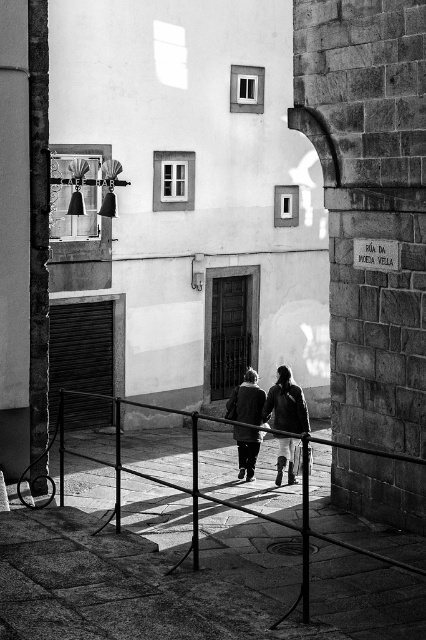
Who is lower down, smooth metal railing at center or dark gray fabric coat at center?

smooth metal railing at center is lower down.

Does smooth metal railing at center have a larger size compared to dark gray fabric coat at center?

Correct, smooth metal railing at center is larger in size than dark gray fabric coat at center.

Measure the distance between point (x=336, y=445) and camera.

Point (x=336, y=445) and camera are 8.82 meters apart.

Image resolution: width=426 pixels, height=640 pixels. I want to click on smooth metal railing at center, so click(285, 522).

Is point (247, 419) more distant than point (245, 429)?

Yes, it is behind point (245, 429).

Is dark gray fabric coat at center to the right of dark gray coat at center from the viewer's perspective?

Yes, dark gray fabric coat at center is to the right of dark gray coat at center.

You are a GUI agent. You are given a task and a screenshot of the screen. Output one action in this format:
    pyautogui.click(x=<x>, y=<y>)
    Task: Click on the dark gray fabric coat at center
    
    Given the screenshot: What is the action you would take?
    pyautogui.click(x=270, y=403)

The image size is (426, 640). I want to click on dark gray fabric coat at center, so click(270, 403).

Between smooth metal railing at center and dark gray coat at center, which one has less height?

dark gray coat at center

Does point (193, 480) come in front of point (241, 404)?

Yes.

You are a GUI agent. You are given a task and a screenshot of the screen. Output one action in this format:
    pyautogui.click(x=<x>, y=<y>)
    Task: Click on the smooth metal railing at center
    The width and height of the screenshot is (426, 640).
    Given the screenshot: What is the action you would take?
    pyautogui.click(x=285, y=522)